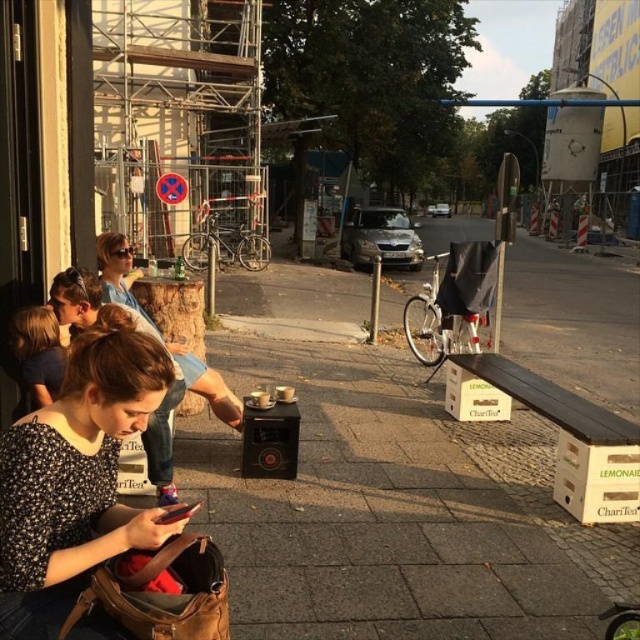
Question: Is white cardboard bus stop at lower right below spotted floral blouse at lower left?

Choices:
 (A) no
 (B) yes

Answer: (B)

Question: Is floral print shirt at center closer to the viewer compared to matte black hair at center?

Choices:
 (A) no
 (B) yes

Answer: (B)

Question: Which point is farther to the camera?

Choices:
 (A) matte black hair at center
 (B) white cardboard bus stop at lower right

Answer: (B)

Question: Among these points, which one is farthest from the camera?

Choices:
 (A) coord(173,362)
 (B) coord(8,580)
 (C) coord(604,426)
 (D) coord(24,364)

Answer: (A)

Question: Which of these objects is positioned closest to the matte black hair at center?

Choices:
 (A) white cardboard bus stop at lower right
 (B) spotted floral blouse at lower left
 (C) floral print shirt at center

Answer: (B)

Question: Does matte black hair at center appear on the left side of spotted floral blouse at lower left?

Choices:
 (A) yes
 (B) no

Answer: (B)